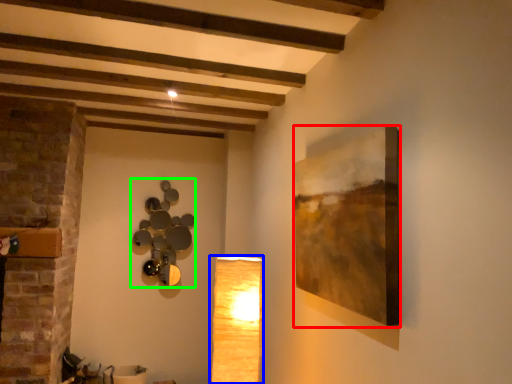
Question: Estimate the real-world distances between objects in this image. Which object is closer to picture frame (highlighted by a red box), lamp (highlighted by a blue box) or lamp (highlighted by a green box)?

Choices:
 (A) lamp
 (B) lamp

Answer: (A)